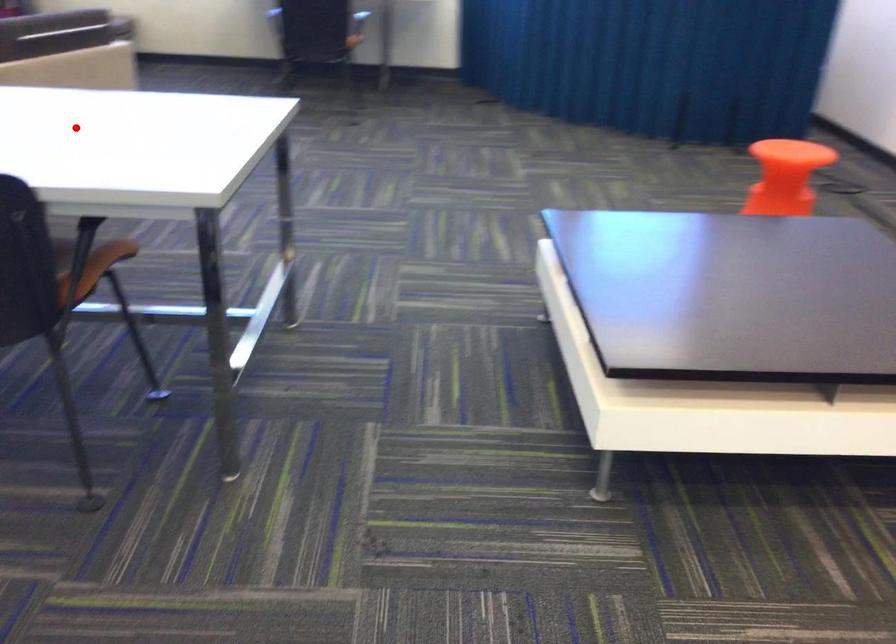
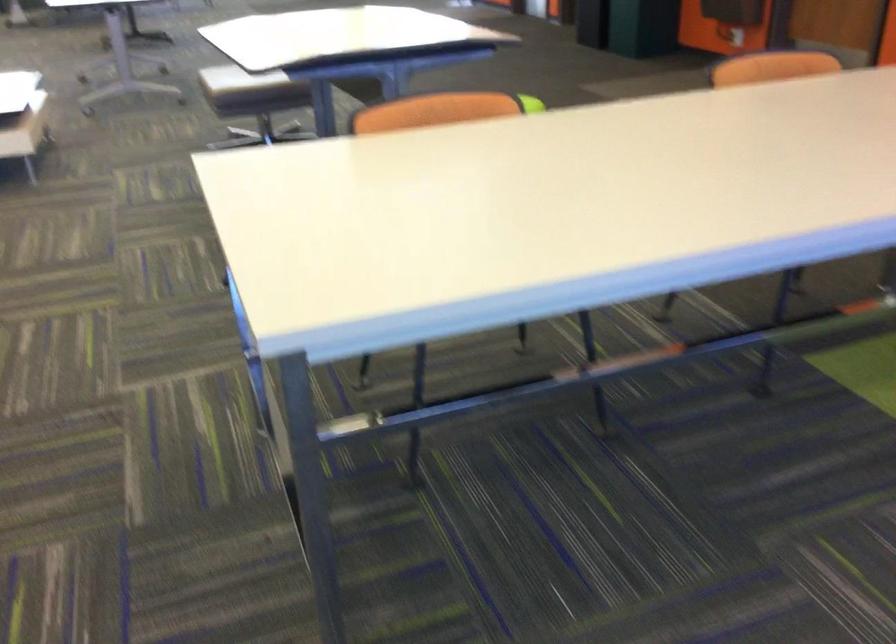
Where in the second image is the point corresponding to the highlighted location from the first image?

(492, 189)